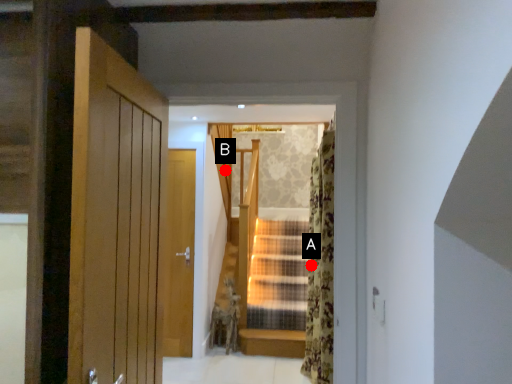
Question: Two points are circled on the image, labeled by A and B beside each circle. Which point is closer to the camera?

Choices:
 (A) A is closer
 (B) B is closer

Answer: (A)